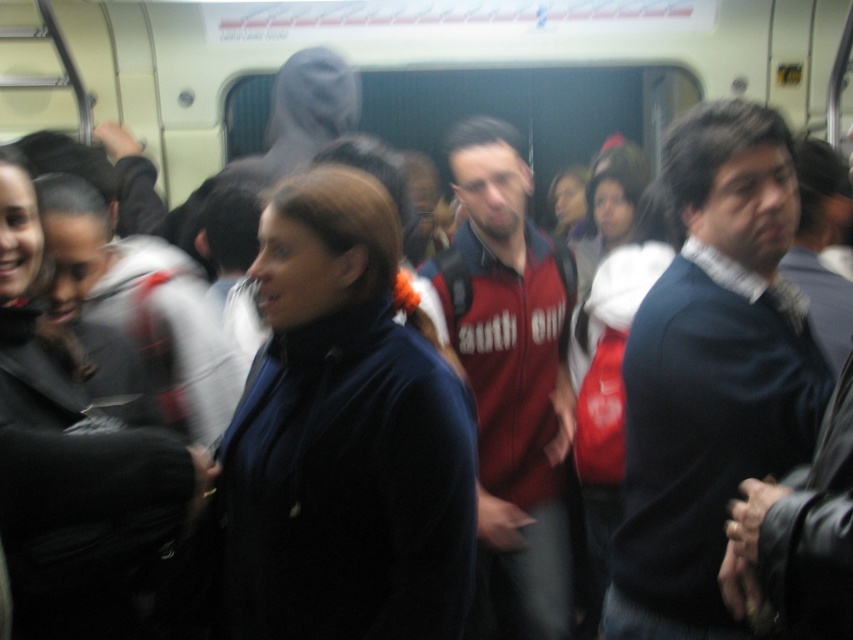
You are standing on the subway and want to take a photo of both the point at coordinates (746, 330) and the point at coordinates (483, 196). Which point should you focus on first to ensure both are in focus?

You should focus on the point at coordinates (746, 330) first because it is closer to the camera than the point at coordinates (483, 196). By focusing on the closer point, the farther point will also be within the depth of field and in focus.

You are standing on a subway car and see a person wearing a dark blue sweater at center. If you want to hand them a document, will you be able to reach them without moving closer?

The dark blue sweater at center is 1.43 meters away from the viewer. Since the average arm length for an adult is about 0.7 meters, you would not be able to reach them without moving closer.

What are the coordinates of the velvet blue jacket at center in the image?

The velvet blue jacket at center is located at coordinates point (344, 435).